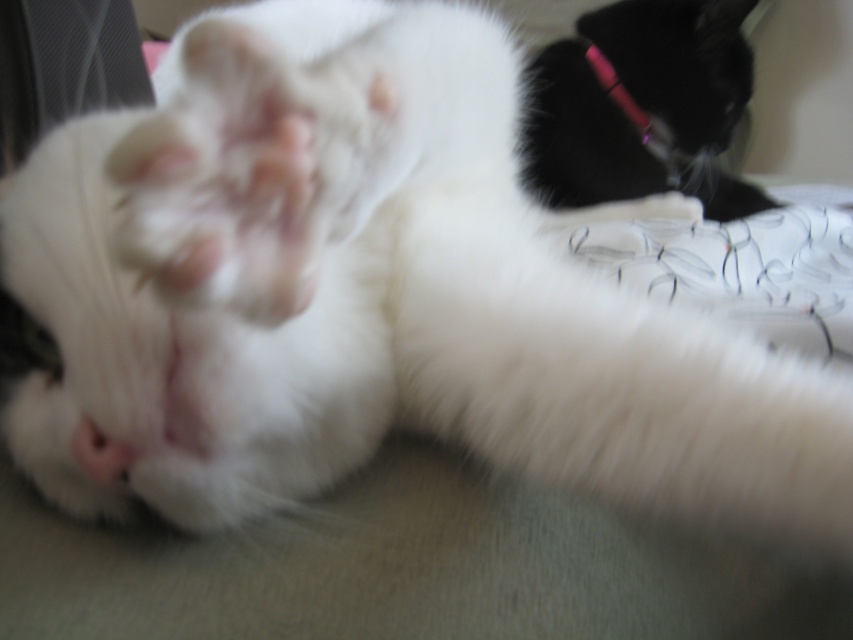
Question: Can you confirm if black fur cat at upper right is thinner than pink plastic pen at upper right?

Choices:
 (A) yes
 (B) no

Answer: (B)

Question: Does black fur cat at upper right appear on the right side of pink plastic pen at upper right?

Choices:
 (A) no
 (B) yes

Answer: (B)

Question: Which point is closer to the camera taking this photo?

Choices:
 (A) (624, 67)
 (B) (621, 108)

Answer: (B)

Question: Which object appears closest to the camera in this image?

Choices:
 (A) black fur cat at upper right
 (B) pink plastic pen at upper right

Answer: (A)

Question: Does black fur cat at upper right have a larger size compared to pink plastic pen at upper right?

Choices:
 (A) yes
 (B) no

Answer: (A)